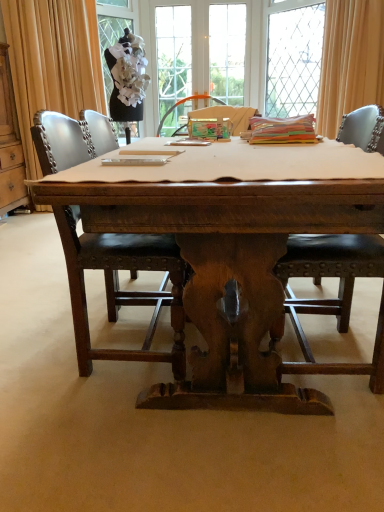
Question: Considering the relative sizes of white matte tablecloth at center and wooden desk at center in the image provided, is white matte tablecloth at center taller than wooden desk at center?

Choices:
 (A) yes
 (B) no

Answer: (B)

Question: Considering the relative sizes of white matte tablecloth at center and wooden desk at center in the image provided, is white matte tablecloth at center bigger than wooden desk at center?

Choices:
 (A) yes
 (B) no

Answer: (B)

Question: From the image's perspective, is white matte tablecloth at center on wooden desk at center?

Choices:
 (A) no
 (B) yes

Answer: (B)

Question: From the image's perspective, is white matte tablecloth at center below wooden desk at center?

Choices:
 (A) yes
 (B) no

Answer: (B)

Question: Can you confirm if white matte tablecloth at center is smaller than wooden desk at center?

Choices:
 (A) no
 (B) yes

Answer: (B)

Question: Would you say wooden cabinet at left is to the left or to the right of brown leather chair at center, acting as the first chair starting from the left, in the picture?

Choices:
 (A) left
 (B) right

Answer: (A)

Question: In terms of size, does wooden cabinet at left appear bigger or smaller than brown leather chair at center, marked as the 2th chair in a right-to-left arrangement?

Choices:
 (A) small
 (B) big

Answer: (B)

Question: Is wooden cabinet at left wider or thinner than brown leather chair at center, acting as the first chair starting from the left?

Choices:
 (A) thin
 (B) wide

Answer: (A)

Question: From a real-world perspective, relative to brown leather chair at center, marked as the 2th chair in a right-to-left arrangement, is wooden cabinet at left vertically above or below?

Choices:
 (A) below
 (B) above

Answer: (B)

Question: Looking at their shapes, would you say black leather chair at center, the second chair in the left-to-right sequence, is wider or thinner than beige fabric curtain at upper right, arranged as the first curtain when viewed from the right?

Choices:
 (A) wide
 (B) thin

Answer: (A)

Question: From the image's perspective, is black leather chair at center, the second chair in the left-to-right sequence, positioned above or below beige fabric curtain at upper right, arranged as the first curtain when viewed from the right?

Choices:
 (A) below
 (B) above

Answer: (A)

Question: From their relative heights in the image, would you say black leather chair at center, which ranks as the 1th chair in right-to-left order, is taller or shorter than beige fabric curtain at upper right, arranged as the first curtain when viewed from the right?

Choices:
 (A) short
 (B) tall

Answer: (A)

Question: Considering the positions of point (362, 129) and point (339, 105), is point (362, 129) closer or farther from the camera than point (339, 105)?

Choices:
 (A) farther
 (B) closer

Answer: (B)

Question: Considering the positions of clear glass window at upper center, the second window in the left-to-right sequence, and beige fabric curtain at upper right, which is the 2th curtain from left to right, in the image, is clear glass window at upper center, the second window in the left-to-right sequence, wider or thinner than beige fabric curtain at upper right, which is the 2th curtain from left to right,?

Choices:
 (A) thin
 (B) wide

Answer: (A)

Question: Is clear glass window at upper center, the second window in the left-to-right sequence, inside or outside of beige fabric curtain at upper right, arranged as the first curtain when viewed from the right?

Choices:
 (A) outside
 (B) inside

Answer: (A)